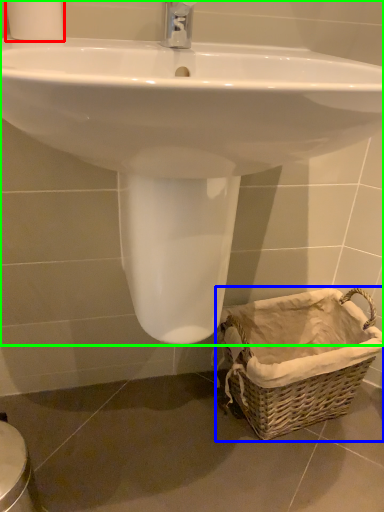
Question: Which object is positioned farthest from toilet paper (highlighted by a red box)? Select from basket (highlighted by a blue box) and sink (highlighted by a green box).

Choices:
 (A) basket
 (B) sink

Answer: (A)